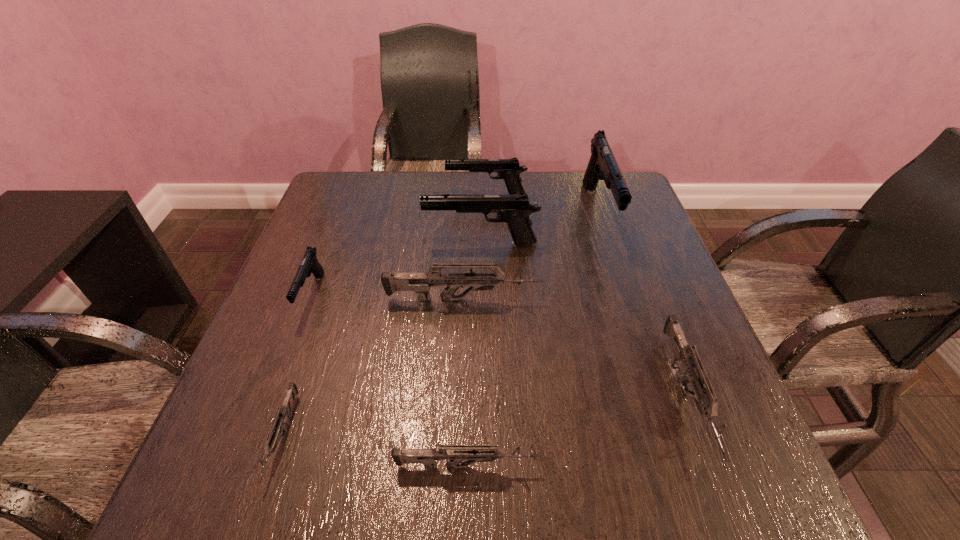
Where is `empty space between the seventh gun from right to left and the rightmost gun`? The width and height of the screenshot is (960, 540). empty space between the seventh gun from right to left and the rightmost gun is located at coordinates (485, 417).

Find the location of `free space between the seventh shortest gun and the rightmost black gun`. free space between the seventh shortest gun and the rightmost black gun is located at coordinates (540, 228).

The width and height of the screenshot is (960, 540). In order to click on unoccupied area between the second smallest black gun and the second tallest gun in this screenshot , I will do `click(484, 220)`.

Locate an element on the screen. The width and height of the screenshot is (960, 540). free spot between the second shortest gun and the tallest object is located at coordinates (532, 339).

Identify which object is the third closest to the nearest black gun. Please provide its 2D coordinates. Your answer should be formatted as a tuple, i.e. [(x, y)], where the tuple contains the x and y coordinates of a point satisfying the conditions above.

[(514, 210)]

Locate which object is the fifth closest to the nearest black gun. Please provide its 2D coordinates. Your answer should be formatted as a tuple, i.e. [(x, y)], where the tuple contains the x and y coordinates of a point satisfying the conditions above.

[(509, 170)]

Point out which gun is positioned as the seventh nearest to the rightmost grey gun. Please provide its 2D coordinates. Your answer should be formatted as a tuple, i.e. [(x, y)], where the tuple contains the x and y coordinates of a point satisfying the conditions above.

[(309, 264)]

Identify which gun is the second nearest to the tallest object. Please provide its 2D coordinates. Your answer should be formatted as a tuple, i.e. [(x, y)], where the tuple contains the x and y coordinates of a point satisfying the conditions above.

[(509, 170)]

The height and width of the screenshot is (540, 960). Identify the location of black gun that is the closest to the rightmost black gun. (514, 210).

Locate an element on the screen. black gun that is the second closest to the shortest object is located at coordinates (514, 210).